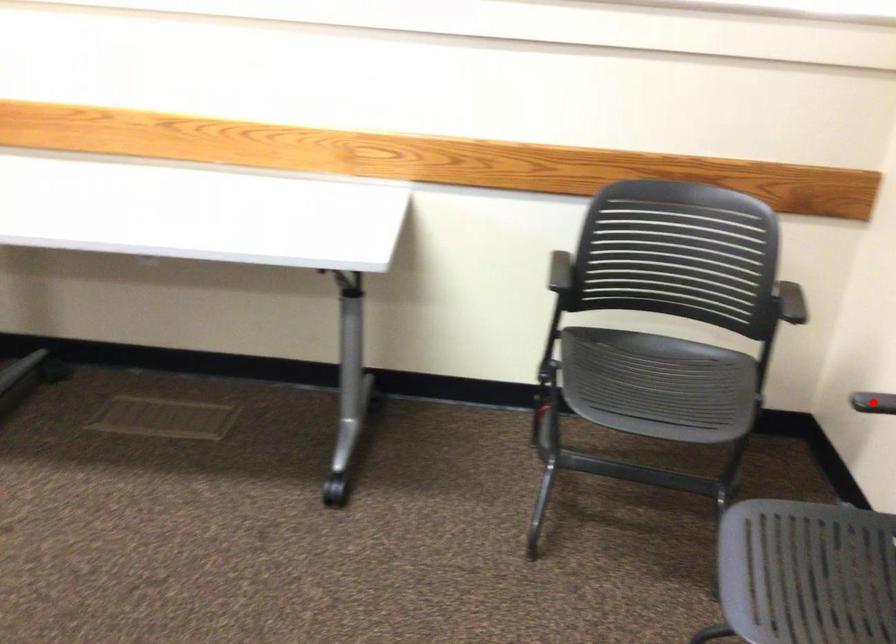
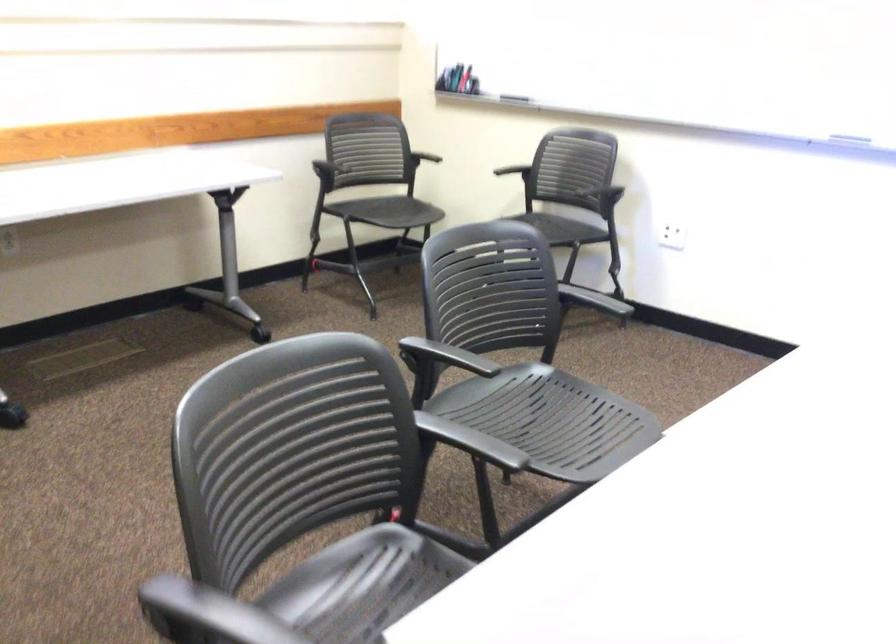
The point at the highlighted location is marked in the first image. Where is the corresponding point in the second image?

(506, 164)